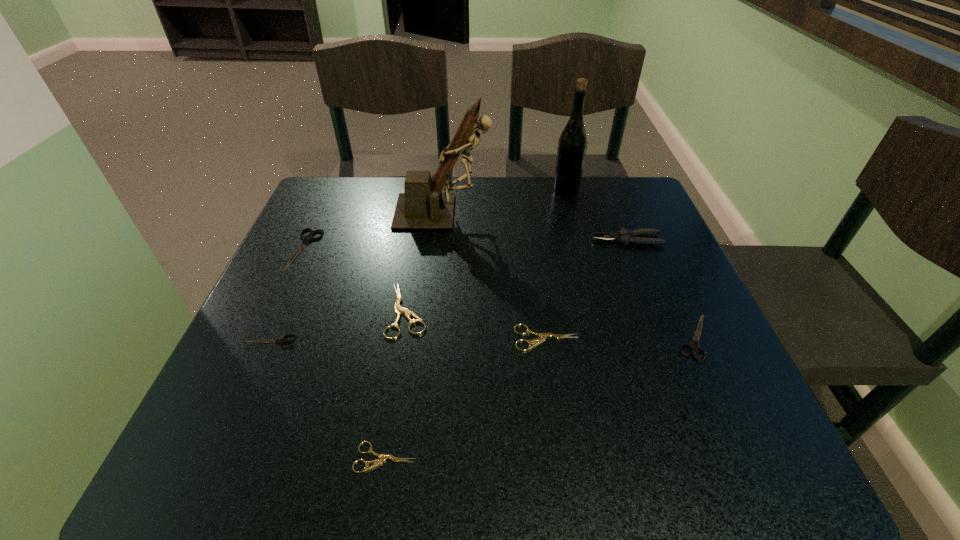
The height and width of the screenshot is (540, 960). I want to click on blank space located on the back of the second biggest black shears, so click(x=662, y=267).

I want to click on free spot located on the left of the biggest beige shears, so point(323,310).

The height and width of the screenshot is (540, 960). What are the coordinates of `vacant region located 0.130m on the left of the second biggest beige shears` in the screenshot? It's located at (444, 338).

You are a GUI agent. You are given a task and a screenshot of the screen. Output one action in this format:
    pyautogui.click(x=<x>, y=<y>)
    Task: Click on the vacant space located 0.400m on the back of the smallest black shears
    The image size is (960, 540).
    Given the screenshot: What is the action you would take?
    pyautogui.click(x=326, y=213)

Locate an element on the screen. The image size is (960, 540). vacant region located on the back of the nearest beige shears is located at coordinates (412, 294).

This screenshot has height=540, width=960. Find the location of `figurine situated at the far edge`. figurine situated at the far edge is located at coordinates (423, 206).

You are a GUI agent. You are given a task and a screenshot of the screen. Output one action in this format:
    pyautogui.click(x=<x>, y=<y>)
    Task: Click on the beer bottle at the far edge
    
    Given the screenshot: What is the action you would take?
    pyautogui.click(x=572, y=145)

Where is `object located at the near edge`? This screenshot has height=540, width=960. object located at the near edge is located at coordinates (382, 457).

Find the location of a particular element. The image size is (960, 540). pliers that is at the right edge is located at coordinates (625, 236).

Identify the location of shears that is at the right edge. The image size is (960, 540). pos(694,347).